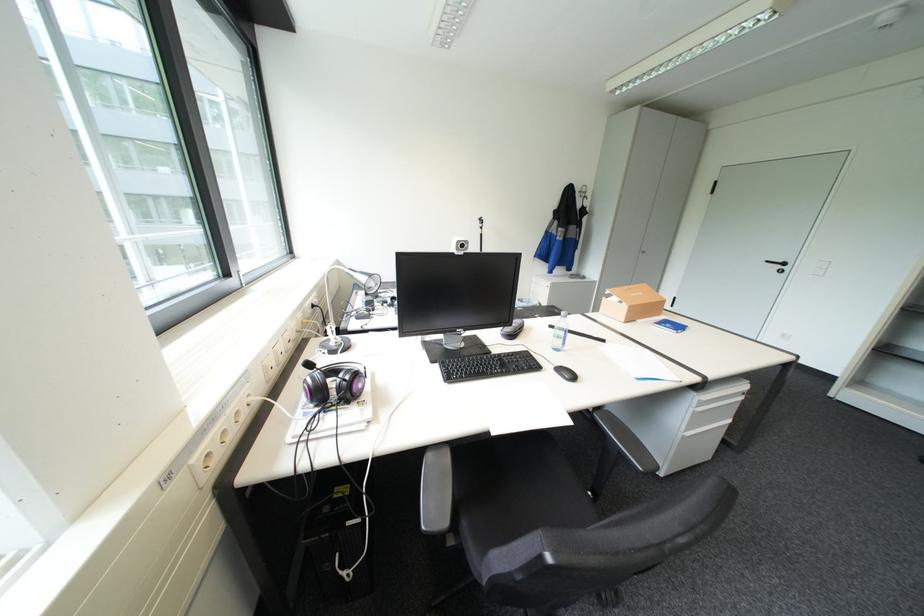
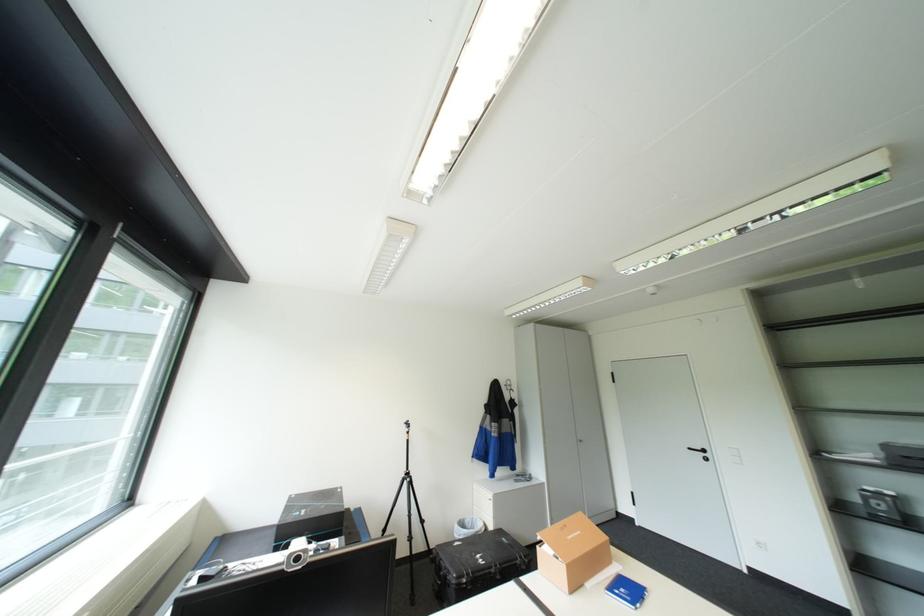
Find the pixel in the second image that matches point (612, 297) in the first image.

(545, 545)